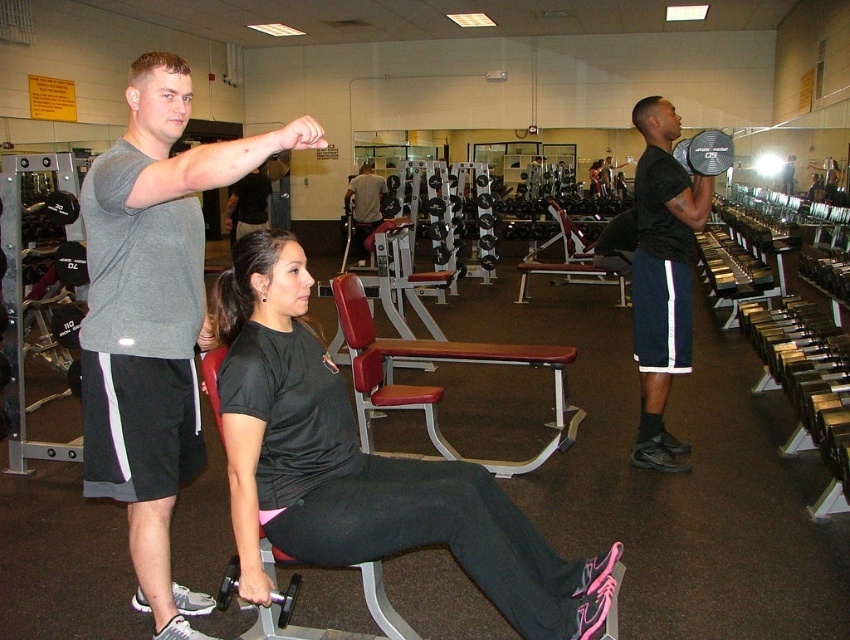
Who is lower down, gray cotton t-shirt at upper left or black matte dumbbell at right?

gray cotton t-shirt at upper left

What do you see at coordinates (153, 317) in the screenshot? The height and width of the screenshot is (640, 850). I see `gray cotton t-shirt at upper left` at bounding box center [153, 317].

You are a GUI agent. You are given a task and a screenshot of the screen. Output one action in this format:
    pyautogui.click(x=<x>, y=<y>)
    Task: Click on the gray cotton t-shirt at upper left
    The height and width of the screenshot is (640, 850).
    Given the screenshot: What is the action you would take?
    pyautogui.click(x=153, y=317)

Can you confirm if red leather bench at center is smaller than matte gray shirt at center?

Actually, red leather bench at center might be larger than matte gray shirt at center.

Does red leather bench at center have a greater width compared to matte gray shirt at center?

Indeed, red leather bench at center has a greater width compared to matte gray shirt at center.

Describe the element at coordinates (435, 385) in the screenshot. The width and height of the screenshot is (850, 640). I see `red leather bench at center` at that location.

Image resolution: width=850 pixels, height=640 pixels. What are the coordinates of `red leather bench at center` in the screenshot? It's located at (435, 385).

Does black matte dumbbell at right have a smaller size compared to red leather bench at center?

Correct, black matte dumbbell at right occupies less space than red leather bench at center.

Does black matte dumbbell at right have a greater width compared to red leather bench at center?

No.

Is point (706, 216) more distant than point (397, 346)?

No, it is not.

I want to click on black matte dumbbell at right, so click(x=663, y=276).